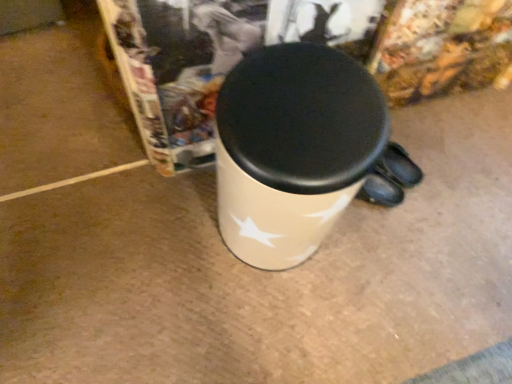
The width and height of the screenshot is (512, 384). In order to click on free space above white glossy mug at center (from a real-world perspective) in this screenshot , I will do `click(302, 109)`.